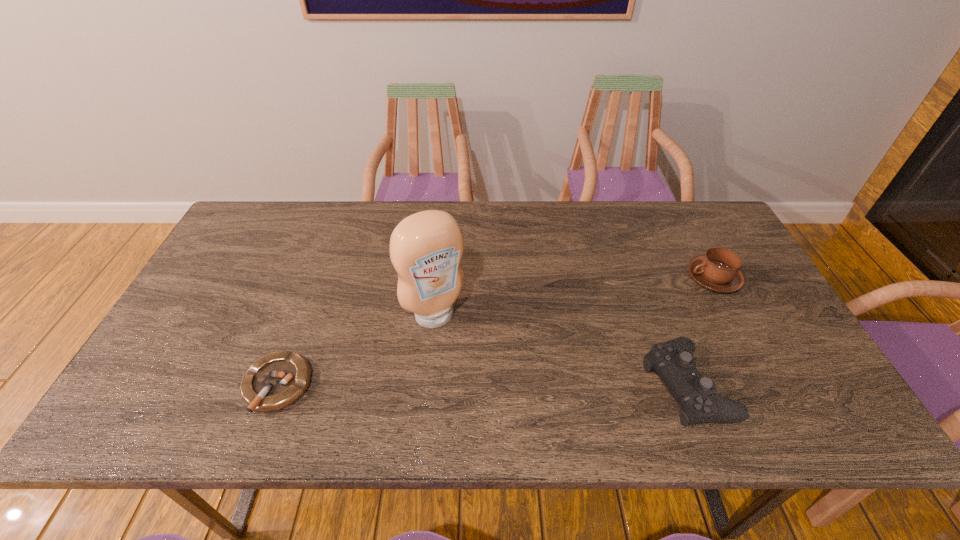
I want to click on the leftmost object, so click(x=275, y=381).

Image resolution: width=960 pixels, height=540 pixels. I want to click on the shortest object, so click(x=275, y=381).

This screenshot has width=960, height=540. What are the coordinates of `control` in the screenshot? It's located at (673, 361).

Locate an element on the screen. cappuccino is located at coordinates (719, 270).

Find the location of `the tallest object`. the tallest object is located at coordinates (426, 248).

Find the location of a particular element. condiment is located at coordinates (426, 248).

Find the location of a particular element. This screenshot has width=960, height=540. vacant space situated 0.160m on the right of the shortest object is located at coordinates (380, 386).

The height and width of the screenshot is (540, 960). Identify the location of free location located 0.180m on the right of the control. (807, 385).

Where is `vacant area situated 0.390m on the side of the rightmost object with the handle`? vacant area situated 0.390m on the side of the rightmost object with the handle is located at coordinates (590, 348).

Identify the location of free space located on the side of the rightmost object with the handle. This screenshot has height=540, width=960. (611, 336).